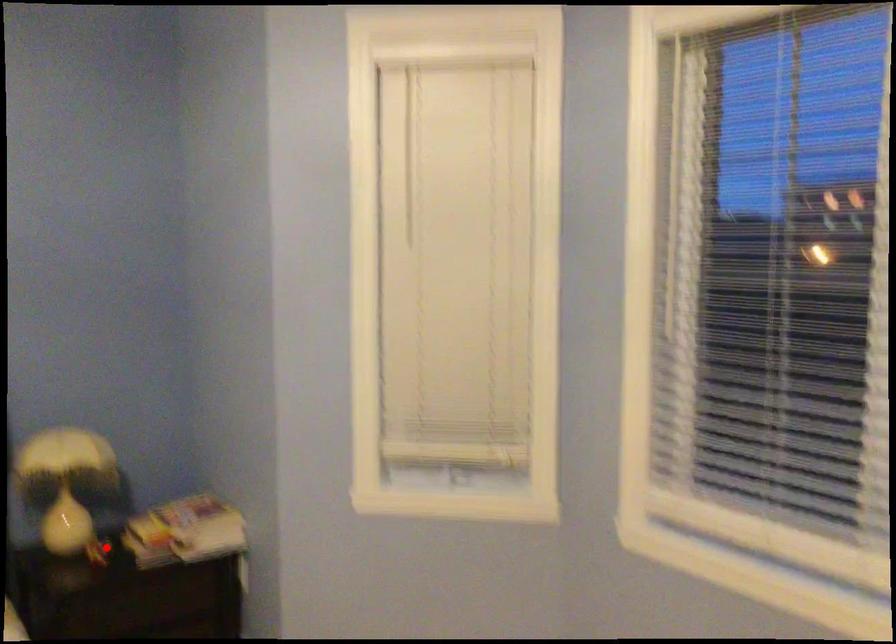
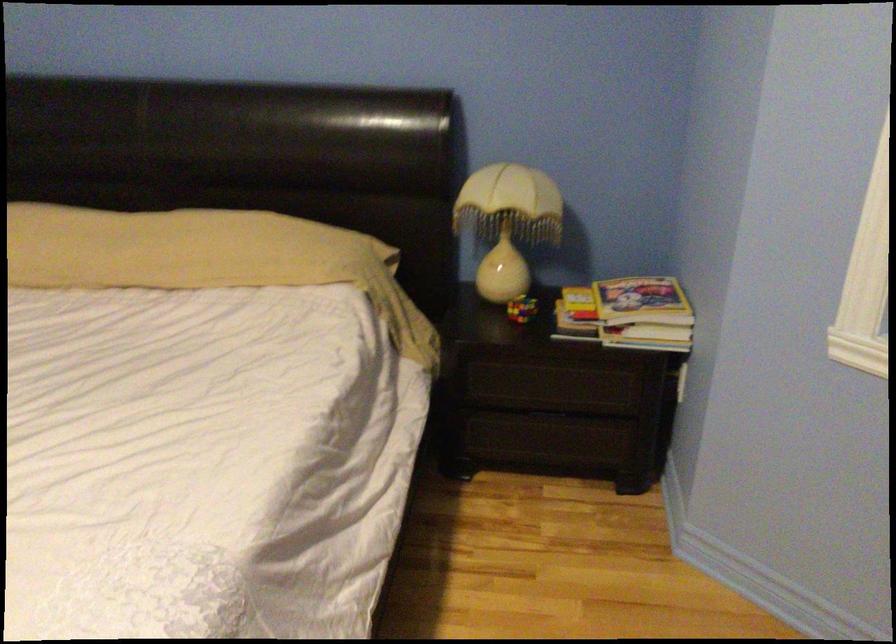
Question: I am providing you with two images of the same scene from different viewpoints. Given a red point in image1, look at the same physical point in image2. Is it:

Choices:
 (A) Closer to the viewpoint
 (B) Farther from the viewpoint

Answer: (A)